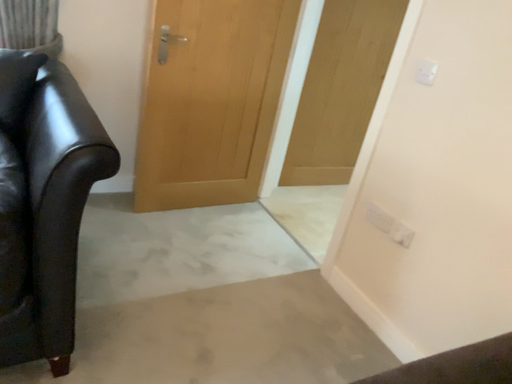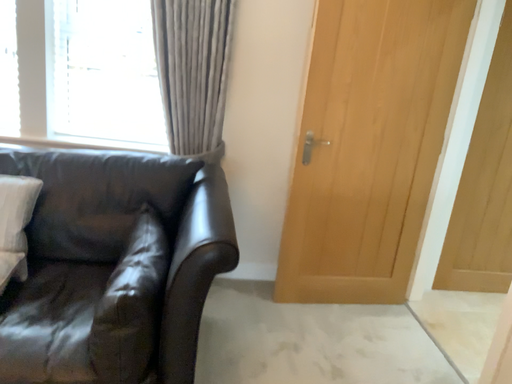
Question: Which way did the camera rotate in the video?

Choices:
 (A) rotated downward
 (B) rotated upward

Answer: (B)